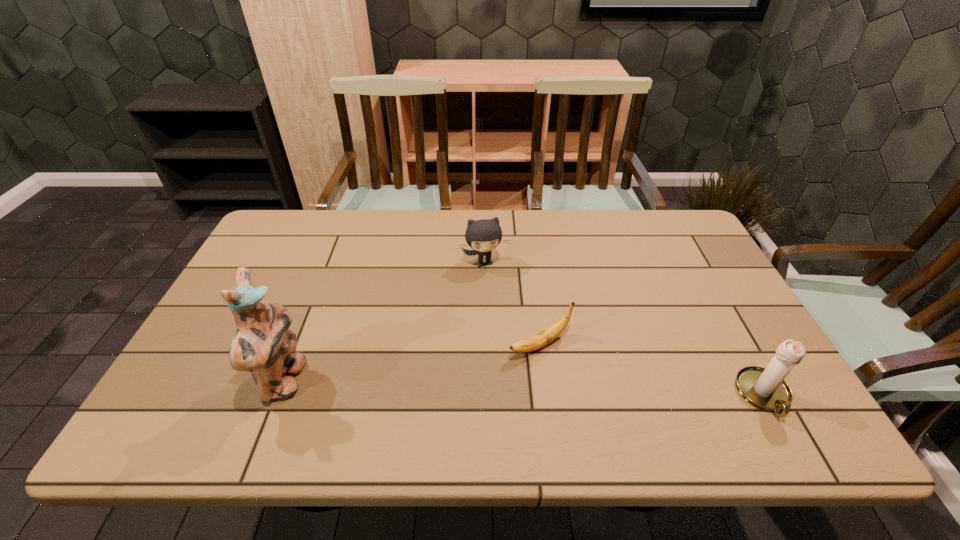
Where is `free space on the desktop that is between the tallest object and the candle holder and is positioned on the peel of the shortest object from the top`? This screenshot has height=540, width=960. free space on the desktop that is between the tallest object and the candle holder and is positioned on the peel of the shortest object from the top is located at coordinates (461, 387).

Identify the location of free spot on the desktop that is between the leftmost object and the candle holder and is positioned on the front-facing side of the farthest object. (515, 388).